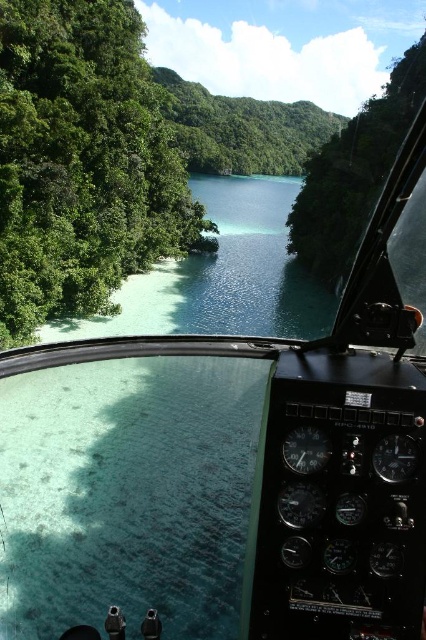
Question: Does green leafy trees at left lie in front of green leafy vegetation at center?

Choices:
 (A) no
 (B) yes

Answer: (B)

Question: Is green leafy trees at left smaller than green leafy vegetation at center?

Choices:
 (A) no
 (B) yes

Answer: (A)

Question: Which of the following is the closest to the observer?

Choices:
 (A) (143, 164)
 (B) (370, 120)

Answer: (A)

Question: Is green leafy trees at left above green leafy vegetation at center?

Choices:
 (A) yes
 (B) no

Answer: (B)